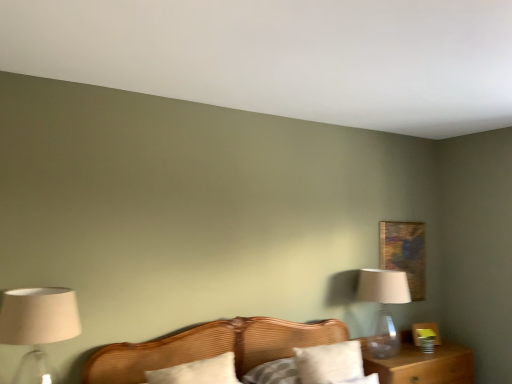
Question: Does point (318, 377) appear closer or farther from the camera than point (387, 309)?

Choices:
 (A) closer
 (B) farther

Answer: (A)

Question: Do you think white cotton pillow at center, the 2th pillow in the left-to-right sequence, is within transparent glass table lamp at right, or outside of it?

Choices:
 (A) outside
 (B) inside

Answer: (A)

Question: Considering the real-world distances, which object is farthest from the matte beige lampshade at left?

Choices:
 (A) transparent glass table lamp at right
 (B) brown wooden nightstand at lower right
 (C) white cotton pillow at center, the 2th pillow in the left-to-right sequence
 (D) white soft pillow at center, marked as the first pillow in a left-to-right arrangement
 (E) wooden picture frame at upper right

Answer: (E)

Question: Considering the real-world distances, which object is closest to the matte beige lampshade at left?

Choices:
 (A) brown wooden nightstand at lower right
 (B) white soft pillow at center, marked as the first pillow in a left-to-right arrangement
 (C) wooden picture frame at upper right
 (D) wooden bed at center
 (E) transparent glass table lamp at right

Answer: (B)